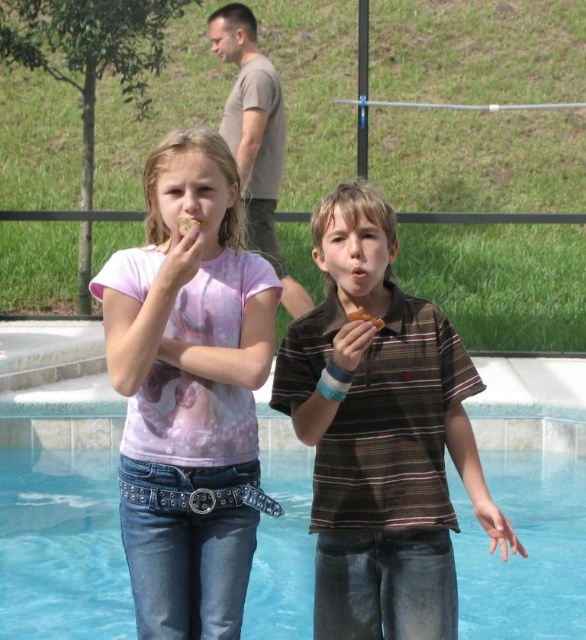
Question: Is transparent glass water at lower center in front of golden brown pastry at upper center?

Choices:
 (A) no
 (B) yes

Answer: (A)

Question: Which point is farther from the camera taking this photo?

Choices:
 (A) (141, 506)
 (B) (21, 588)
 (C) (379, 340)
 (D) (197, 225)

Answer: (B)

Question: Which object is closer to the camera taking this photo?

Choices:
 (A) pink tie-dye t-shirt at center
 (B) matte brown cookie at upper center
 (C) brown striped shirt at center

Answer: (A)

Question: Does pink tie-dye t-shirt at center appear on the left side of golden brown pastry at upper center?

Choices:
 (A) yes
 (B) no

Answer: (A)

Question: Based on their relative distances, which object is nearer to the pink tie-dye t-shirt at center?

Choices:
 (A) golden brown pastry at upper center
 (B) brown striped shirt at center

Answer: (B)

Question: Does transparent glass water at lower center come in front of golden brown pastry at upper center?

Choices:
 (A) yes
 (B) no

Answer: (B)